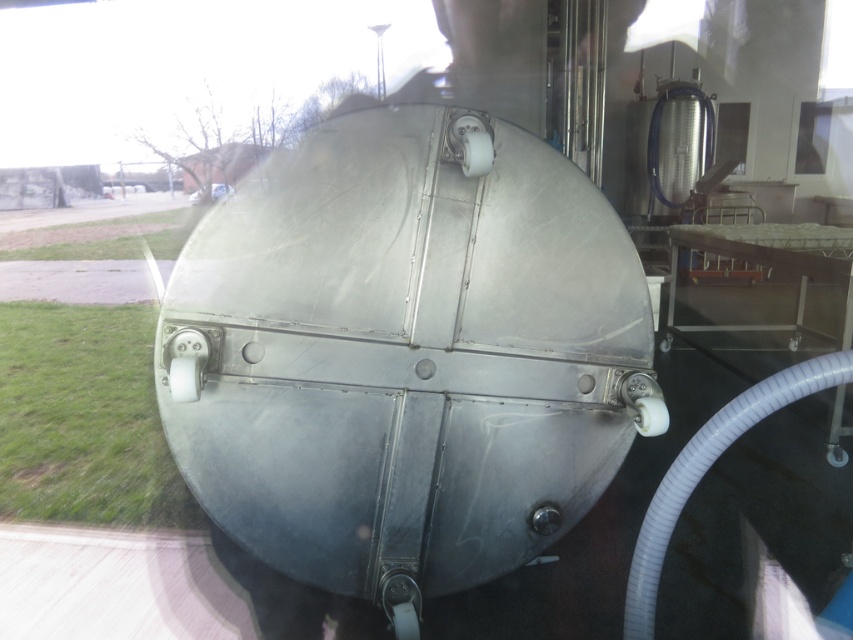
Question: Considering the relative positions of transparent glass window at upper right and clear glass window at upper right in the image provided, where is transparent glass window at upper right located with respect to clear glass window at upper right?

Choices:
 (A) left
 (B) right

Answer: (B)

Question: Considering the relative positions of polished metallic tank at center and transparent glass window at upper right in the image provided, where is polished metallic tank at center located with respect to transparent glass window at upper right?

Choices:
 (A) right
 (B) left

Answer: (B)

Question: Among these points, which one is farthest from the camera?

Choices:
 (A) (740, 116)
 (B) (810, 161)
 (C) (830, 227)
 (D) (451, 465)

Answer: (B)

Question: Which point appears closest to the camera in this image?

Choices:
 (A) (837, 228)
 (B) (561, 196)

Answer: (B)

Question: Is metallic silver tray at center closer to camera compared to transparent glass window at upper right?

Choices:
 (A) no
 (B) yes

Answer: (B)

Question: Which point is closer to the camera?

Choices:
 (A) polished metallic tank at center
 (B) metallic silver tray at center
 (C) transparent glass window at upper right

Answer: (A)